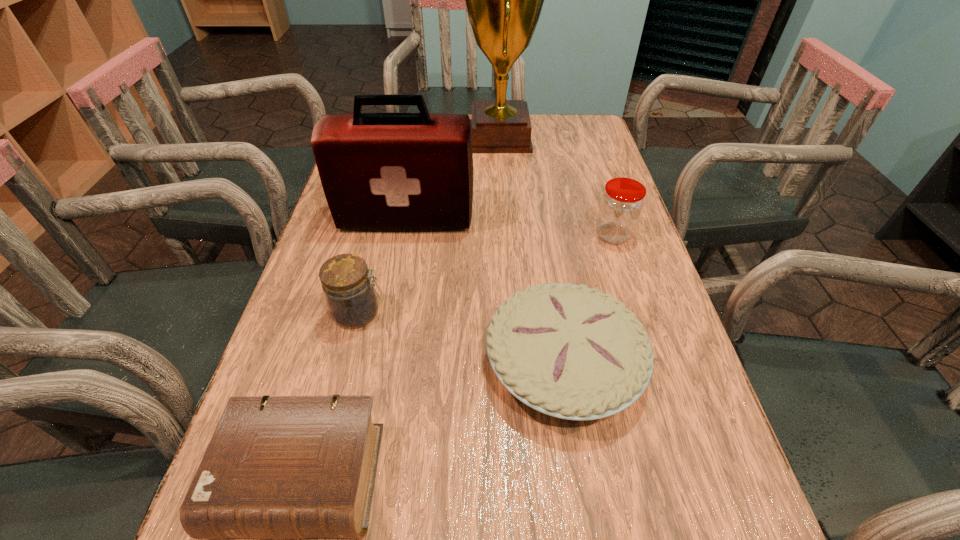
Where is `blank space at the right edge of the desktop`? Image resolution: width=960 pixels, height=540 pixels. blank space at the right edge of the desktop is located at coordinates (695, 409).

Where is `vacant region at the far right corner`? Image resolution: width=960 pixels, height=540 pixels. vacant region at the far right corner is located at coordinates (587, 146).

This screenshot has height=540, width=960. In order to click on free space between the pie and the left jar in this screenshot , I will do `click(462, 338)`.

This screenshot has width=960, height=540. I want to click on empty location between the pie and the fifth shortest object, so click(x=485, y=291).

Locate an element on the screen. This screenshot has height=540, width=960. the closest object to the nearer jar is located at coordinates (277, 467).

This screenshot has width=960, height=540. In order to click on the second closest object to the award in this screenshot , I will do `click(621, 204)`.

In order to click on vacant space that satisfies the following two spatial constraints: 1. on the back side of the pie; 2. on the plaque of the farthest object in this screenshot , I will do `click(529, 138)`.

Find the location of a particular element. This screenshot has width=960, height=540. free space that satisfies the following two spatial constraints: 1. on the plaque of the award; 2. on the side of the second tallest object with the cross symbol is located at coordinates (505, 218).

This screenshot has height=540, width=960. In order to click on vacant position in the image that satisfies the following two spatial constraints: 1. on the plaque of the right jar; 2. on the left side of the tallest object in this screenshot , I will do `click(506, 235)`.

At what (x,y) coordinates should I click in order to perform the action: click on vacant region that satisfies the following two spatial constraints: 1. on the back side of the pie; 2. on the lid of the nearer jar. Please return your answer as a coordinate pair (x, y). The image size is (960, 540). Looking at the image, I should click on (556, 313).